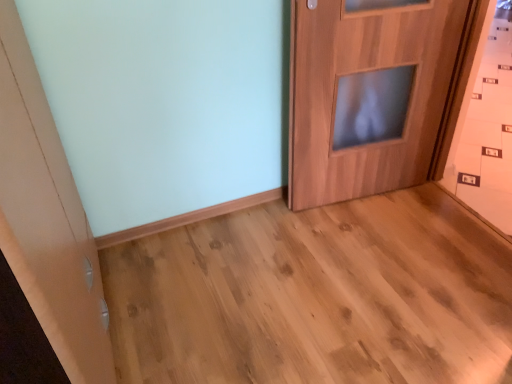
Find the location of a particular element. Image resolution: width=512 pixels, height=384 pixels. natural wood floor at center is located at coordinates (316, 296).

Measure the distance between point [366,350] and camera.

Point [366,350] and camera are 4.73 feet apart from each other.

This screenshot has width=512, height=384. Describe the element at coordinates (316, 296) in the screenshot. I see `natural wood floor at center` at that location.

Identify the location of wooden door at center. This screenshot has height=384, width=512. (367, 94).

What do you see at coordinates (367, 94) in the screenshot? I see `wooden door at center` at bounding box center [367, 94].

Measure the distance between point (418, 74) and camera.

Point (418, 74) and camera are 5.91 feet apart.

Identify the location of natural wood floor at center. The image size is (512, 384). 316,296.

Between wooden door at center and natural wood floor at center, which one appears on the right side from the viewer's perspective?

Positioned to the right is wooden door at center.

Between wooden door at center and natural wood floor at center, which one is positioned behind?

wooden door at center is behind.

Which is nearer, (346, 135) or (121, 245)?

The point (121, 245) is closer to the camera.

From the image's perspective, would you say wooden door at center is positioned over natural wood floor at center?

Yes, from the image's perspective, wooden door at center is above natural wood floor at center.

From a real-world perspective, which object rests below the other?

From a 3D spatial view, natural wood floor at center is below.

Which object is thinner, wooden door at center or natural wood floor at center?

wooden door at center.

Is wooden door at center shorter than natural wood floor at center?

No.

Can you confirm if wooden door at center is bigger than natural wood floor at center?

Incorrect, wooden door at center is not larger than natural wood floor at center.

Is wooden door at center spatially inside natural wood floor at center, or outside of it?

wooden door at center is spatially situated outside natural wood floor at center.

Is wooden door at center placed right next to natural wood floor at center?

They are not placed beside each other.

Is wooden door at center oriented away from natural wood floor at center?

wooden door at center does not have its back to natural wood floor at center.

What's the angular difference between wooden door at center and natural wood floor at center's facing directions?

The facing directions of wooden door at center and natural wood floor at center are 94.2 degrees apart.

Image resolution: width=512 pixels, height=384 pixels. In order to click on corridor in front of the wooden door at center in this screenshot , I will do `click(316, 296)`.

From the picture: Is natural wood floor at center at the left side of wooden door at center?

Indeed, natural wood floor at center is positioned on the left side of wooden door at center.

Is natural wood floor at center in front of wooden door at center?

That is True.

Does point (451, 306) appear closer or farther from the camera than point (453, 57)?

Point (451, 306) is positioned closer to the camera compared to point (453, 57).

From the image's perspective, is natural wood floor at center above wooden door at center?

No, from the image's perspective, natural wood floor at center is not over wooden door at center.

From a real-world perspective, which is physically above, natural wood floor at center or wooden door at center?

From a 3D spatial view, wooden door at center is above.

Between natural wood floor at center and wooden door at center, which one has larger width?

natural wood floor at center is wider.

From their relative heights in the image, would you say natural wood floor at center is taller or shorter than wooden door at center?

In the image, natural wood floor at center appears to be shorter than wooden door at center.

Does natural wood floor at center have a larger size compared to wooden door at center?

Correct, natural wood floor at center is larger in size than wooden door at center.

Is wooden door at center located within natural wood floor at center?

No, wooden door at center is not a part of natural wood floor at center.

Would you consider natural wood floor at center to be distant from wooden door at center?

That's not correct — natural wood floor at center is a little close to wooden door at center.

Looking at this image, is natural wood floor at center oriented towards wooden door at center?

No, natural wood floor at center is not oriented towards wooden door at center.

Looking at this image, how many degrees apart are the facing directions of natural wood floor at center and wooden door at center?

The angular difference between natural wood floor at center and wooden door at center is 94.2 degrees.

How distant is natural wood floor at center from wooden door at center?

natural wood floor at center and wooden door at center are 21.92 inches apart.

Find the location of a particular element. corridor located underneath the wooden door at center (from a real-world perspective) is located at coordinates (316, 296).

Find the location of a particular element. Image resolution: width=512 pixels, height=384 pixels. door behind the natural wood floor at center is located at coordinates (367, 94).

In the image, there is a natural wood floor at center. At what (x,y) coordinates should I click in order to perform the action: click on door above it (from the image's perspective). Please return your answer as a coordinate pair (x, y). The width and height of the screenshot is (512, 384). Looking at the image, I should click on (367, 94).